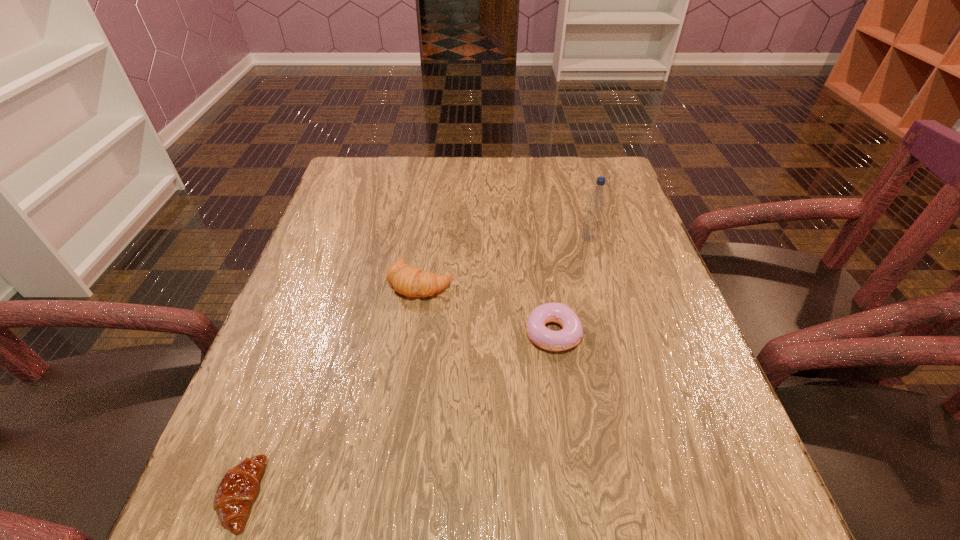
Identify the location of vacant region between the right crescent roll and the doughnut. (487, 308).

This screenshot has height=540, width=960. In order to click on vacant space that is in between the doughnut and the farthest object in this screenshot , I will do `click(571, 286)`.

Locate which object ranks third in proximity to the right crescent roll. Please provide its 2D coordinates. Your answer should be formatted as a tuple, i.e. [(x, y)], where the tuple contains the x and y coordinates of a point satisfying the conditions above.

[(237, 489)]

Identify which object is the second nearest to the second shortest object. Please provide its 2D coordinates. Your answer should be formatted as a tuple, i.e. [(x, y)], where the tuple contains the x and y coordinates of a point satisfying the conditions above.

[(596, 202)]

Locate an element on the screen. free space that satisfies the following two spatial constraints: 1. on the back side of the second object from right to left; 2. on the left side of the nearest object is located at coordinates (300, 333).

Where is `blank area in the image that satisfies the following two spatial constraints: 1. on the back side of the farthest object; 2. on the left side of the shorter crescent roll`? The height and width of the screenshot is (540, 960). blank area in the image that satisfies the following two spatial constraints: 1. on the back side of the farthest object; 2. on the left side of the shorter crescent roll is located at coordinates (336, 239).